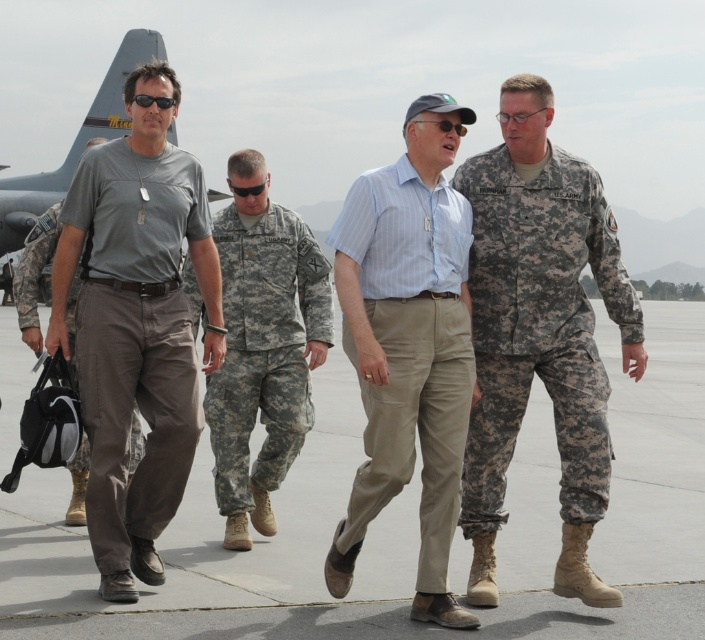
Question: Can you confirm if light gray concrete at center is positioned above camouflage uniform at center?

Choices:
 (A) no
 (B) yes

Answer: (A)

Question: Which object is closer to the camera taking this photo?

Choices:
 (A) camouflage fabric uniform at center
 (B) gray cotton t-shirt at left
 (C) camouflage uniform at center
 (D) light gray concrete at center

Answer: (D)

Question: Is camouflage uniform at center in front of gray/cotton pants at left?

Choices:
 (A) yes
 (B) no

Answer: (A)

Question: Does gray cotton t-shirt at left have a greater width compared to light blue striped shirt at center?

Choices:
 (A) yes
 (B) no

Answer: (A)

Question: Which of the following is the closest to the observer?

Choices:
 (A) (274, 406)
 (B) (176, 326)
 (C) (474, 369)

Answer: (C)

Question: Among these objects, which one is farthest from the camera?

Choices:
 (A) gray cotton t-shirt at left
 (B) gray/cotton pants at left
 (C) matte gray airplane at upper left
 (D) light blue striped shirt at center

Answer: (C)